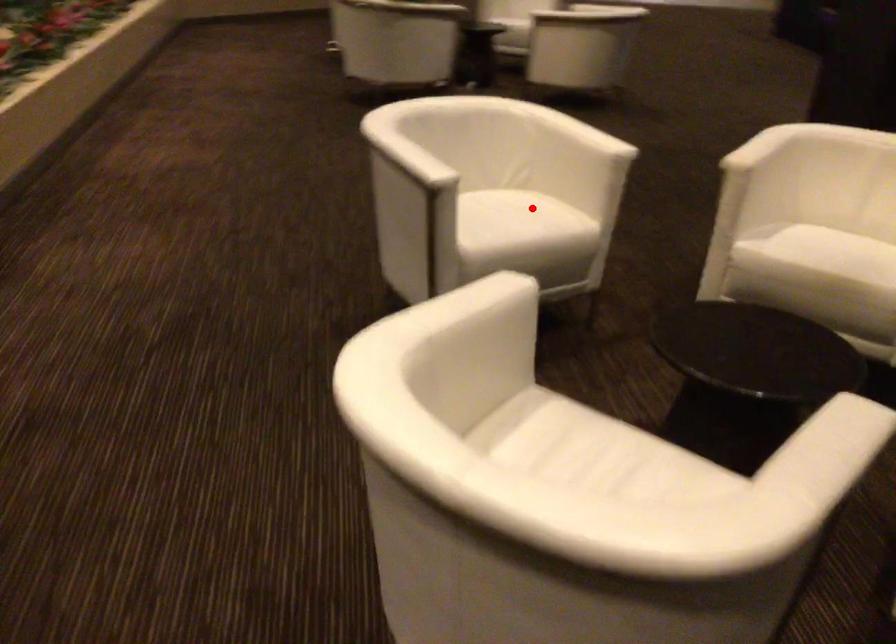
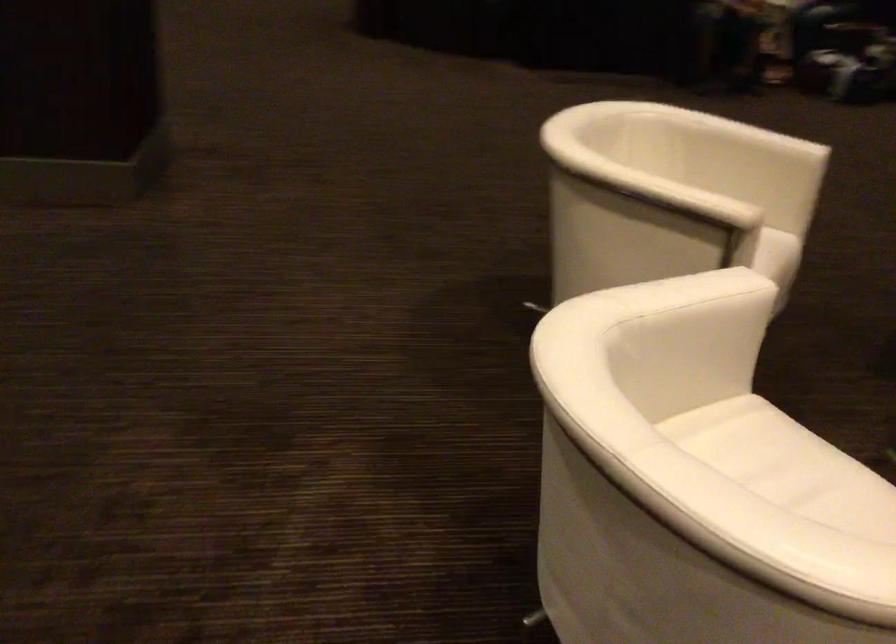
Question: I am providing you with two images of the same scene from different viewpoints. A red point is shown in image1. For the corresponding object point in image2, is it positioned nearer or farther from the camera?

Choices:
 (A) Nearer
 (B) Farther

Answer: (A)